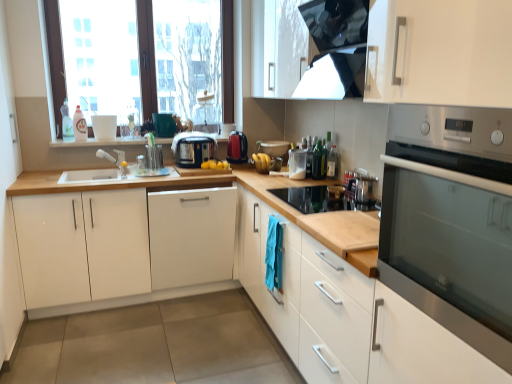
The image size is (512, 384). In order to click on free space on the front side of white plastic faucet at upper left in this screenshot , I will do `click(100, 177)`.